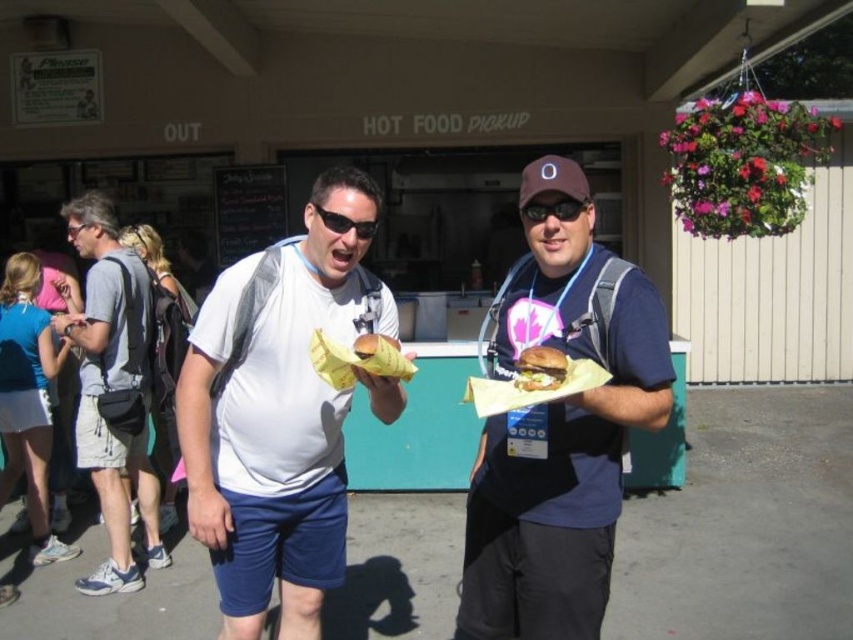
Question: Among these objects, which one is nearest to the camera?

Choices:
 (A) black plastic goggles at center
 (B) golden brown bun at center

Answer: (B)

Question: Which point appears farthest from the camera in this image?

Choices:
 (A) (560, 365)
 (B) (88, 342)
 (C) (529, 220)

Answer: (B)

Question: Can you confirm if black plastic goggles at center is positioned above black plastic goggles at upper left?

Choices:
 (A) yes
 (B) no

Answer: (B)

Question: Which point is closer to the camera?

Choices:
 (A) (77, 224)
 (B) (196, 339)
 (C) (549, 356)

Answer: (C)

Question: Does white matte shirt at center have a smaller size compared to black plastic sunglasses at center?

Choices:
 (A) yes
 (B) no

Answer: (B)

Question: Is golden brown bun at center positioned behind black plastic sunglasses at center?

Choices:
 (A) yes
 (B) no

Answer: (B)